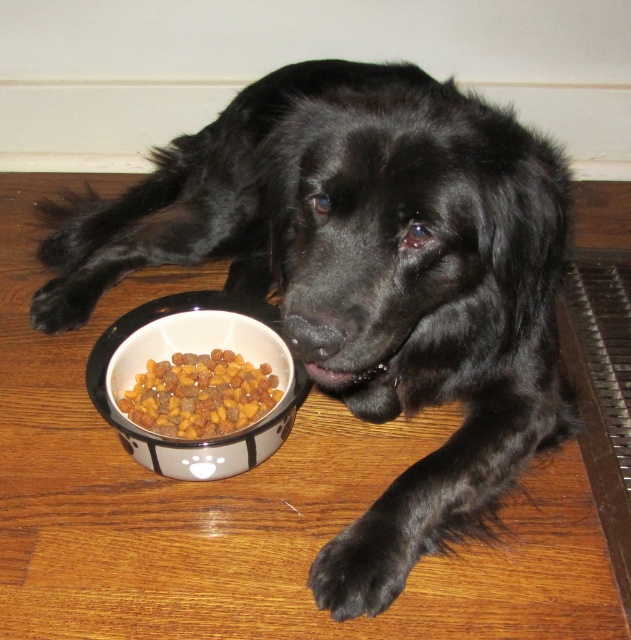
Question: Which point is closer to the camera taking this photo?

Choices:
 (A) (249, 417)
 (B) (269, 353)

Answer: (A)

Question: Which of the following is the closest to the observer?

Choices:
 (A) brown crunchy kibble at lower left
 (B) white glossy bowl at lower left

Answer: (B)

Question: Which point is farther from the camera taking this photo?

Choices:
 (A) (304, 390)
 (B) (251, 408)

Answer: (B)

Question: Does white glossy bowl at lower left come in front of brown crunchy kibble at lower left?

Choices:
 (A) yes
 (B) no

Answer: (A)

Question: Can you confirm if white glossy bowl at lower left is positioned above brown crunchy kibble at lower left?

Choices:
 (A) no
 (B) yes

Answer: (B)

Question: Is white glossy bowl at lower left closer to the viewer compared to brown crunchy kibble at lower left?

Choices:
 (A) no
 (B) yes

Answer: (B)